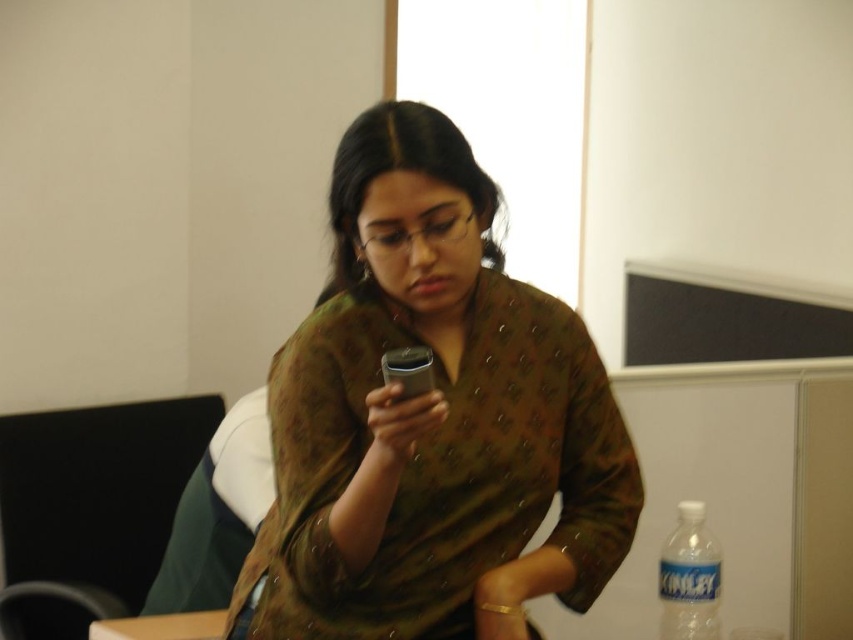
Question: Can you confirm if brown textured shawl at center is thinner than white plastic bottle at right?

Choices:
 (A) yes
 (B) no

Answer: (B)

Question: Is the position of brown textured shawl at center more distant than that of clear plastic bottle at lower right?

Choices:
 (A) yes
 (B) no

Answer: (B)

Question: Which object appears closest to the camera in this image?

Choices:
 (A) wooden table at lower left
 (B) clear plastic bottle at lower right
 (C) brown textured shawl at center

Answer: (C)

Question: Which object is the farthest from the wooden table at lower left?

Choices:
 (A) white plastic bottle at right
 (B) brown textured shawl at center

Answer: (A)

Question: Can you confirm if wooden table at lower left is positioned below white plastic bottle at right?

Choices:
 (A) no
 (B) yes

Answer: (B)

Question: Which of the following is the farthest from the observer?

Choices:
 (A) brown textured shawl at center
 (B) clear plastic bottle at lower right
 (C) white plastic bottle at right
 (D) wooden table at lower left

Answer: (D)